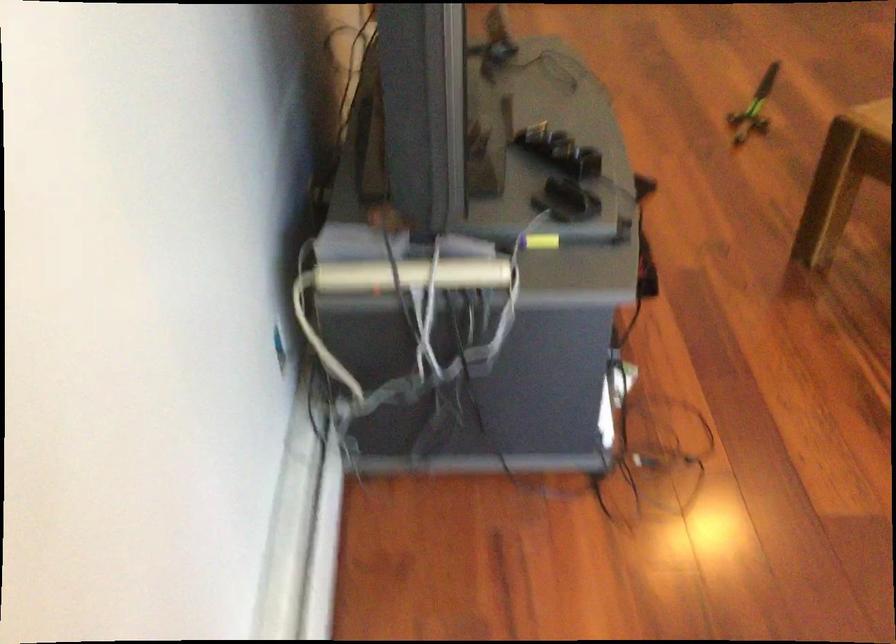
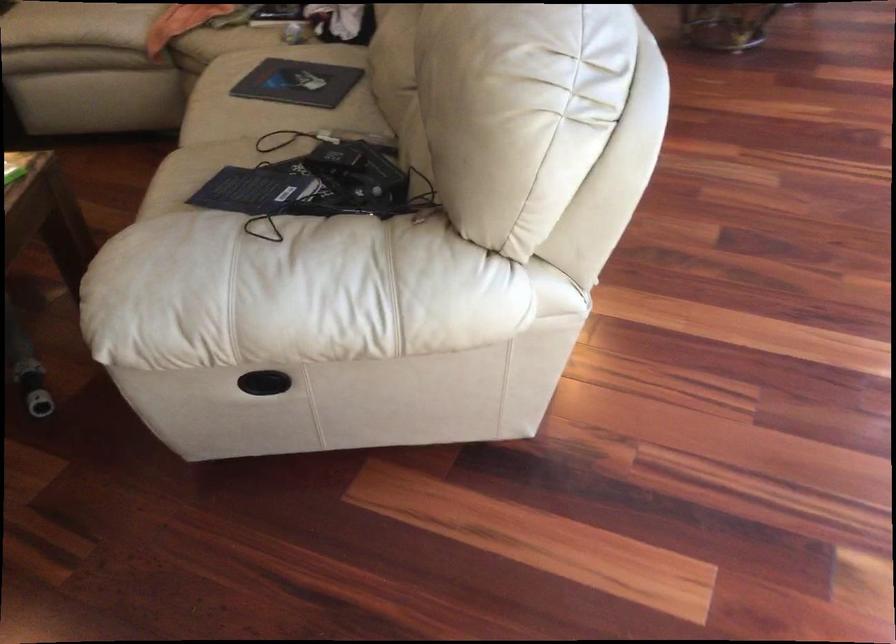
Based on the continuous images, in which direction is the camera rotating?

The camera rotated toward right-down.